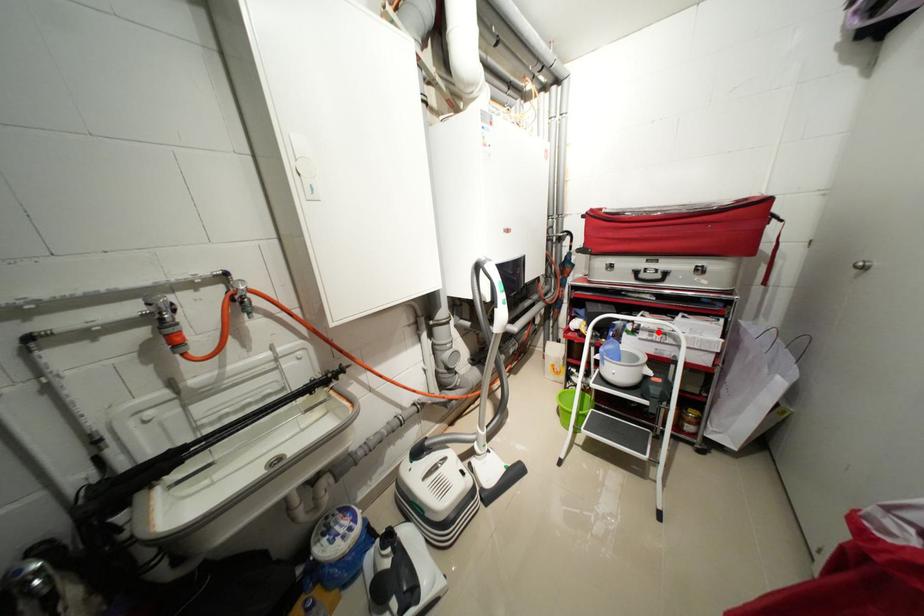
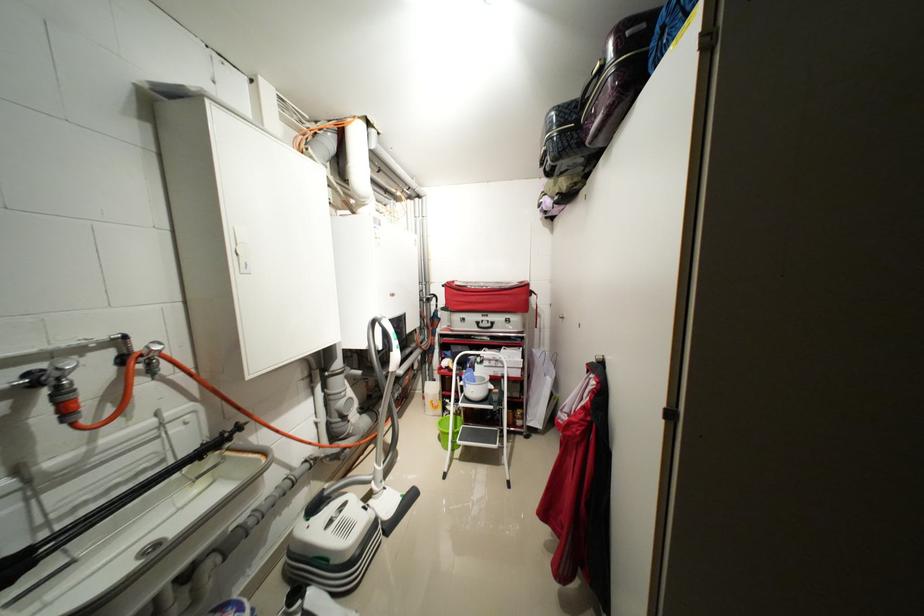
Where in the second image is the point corresponding to the highlighted location from the first image?

(496, 361)